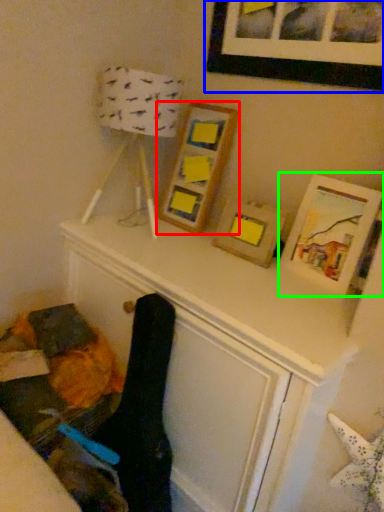
Question: Which is farther away from picture frame (highlighted by a red box)? picture frame (highlighted by a blue box) or picture frame (highlighted by a green box)?

Choices:
 (A) picture frame
 (B) picture frame

Answer: (B)